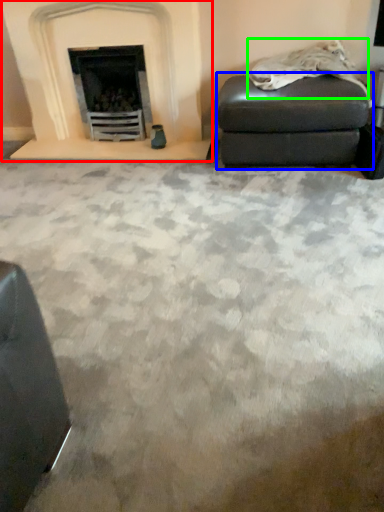
Question: Estimate the real-world distances between objects in this image. Which object is farther from fireplace (highlighted by a red box), stool (highlighted by a blue box) or material (highlighted by a green box)?

Choices:
 (A) stool
 (B) material

Answer: (B)